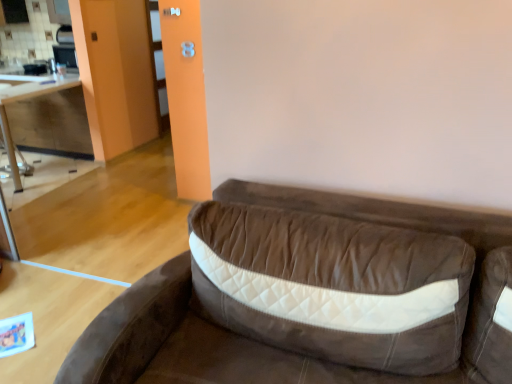
Question: Should I look upward or downward to see wooden table at left?

Choices:
 (A) down
 (B) up

Answer: (B)

Question: Is wooden cabinet at left bigger than brown suede studio couch at center?

Choices:
 (A) yes
 (B) no

Answer: (B)

Question: Does wooden cabinet at left have a smaller size compared to brown suede studio couch at center?

Choices:
 (A) no
 (B) yes

Answer: (B)

Question: Is wooden cabinet at left taller than brown suede studio couch at center?

Choices:
 (A) yes
 (B) no

Answer: (B)

Question: Is brown suede studio couch at center at the back of wooden cabinet at left?

Choices:
 (A) yes
 (B) no

Answer: (B)

Question: Does wooden cabinet at left have a greater width compared to brown suede studio couch at center?

Choices:
 (A) yes
 (B) no

Answer: (B)

Question: From a real-world perspective, is wooden cabinet at left located beneath brown suede studio couch at center?

Choices:
 (A) no
 (B) yes

Answer: (A)

Question: Does brown suede studio couch at center appear on the left side of wooden cabinet at left?

Choices:
 (A) no
 (B) yes

Answer: (A)

Question: Could you tell me if brown suede studio couch at center is turned towards wooden cabinet at left?

Choices:
 (A) no
 (B) yes

Answer: (A)

Question: From the image's perspective, would you say brown suede studio couch at center is positioned over wooden cabinet at left?

Choices:
 (A) no
 (B) yes

Answer: (A)

Question: Is brown suede studio couch at center taller than wooden cabinet at left?

Choices:
 (A) yes
 (B) no

Answer: (A)

Question: Considering the relative positions of brown suede studio couch at center and wooden cabinet at left in the image provided, is brown suede studio couch at center to the right of wooden cabinet at left from the viewer's perspective?

Choices:
 (A) yes
 (B) no

Answer: (A)

Question: From a real-world perspective, is brown suede studio couch at center on wooden cabinet at left?

Choices:
 (A) yes
 (B) no

Answer: (B)

Question: Is wooden table at left wider than wooden cabinet at left?

Choices:
 (A) yes
 (B) no

Answer: (B)